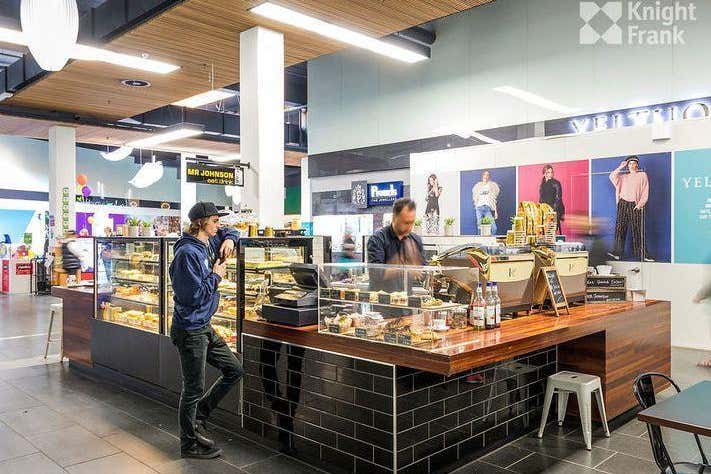
The width and height of the screenshot is (711, 474). Identify the location of people in posters. (438, 194), (552, 188), (488, 192), (641, 188).